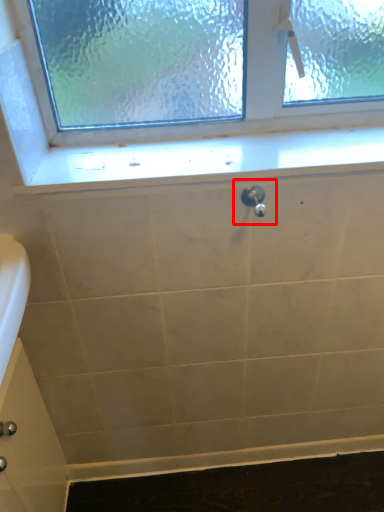
Question: Where is plumbing fixture (annotated by the red box) located in relation to window sill in the image?

Choices:
 (A) right
 (B) left

Answer: (A)